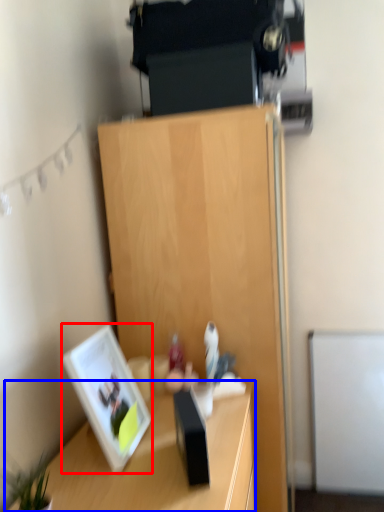
Question: Which point is further to the camera, picture frame (highlighted by a red box) or desk (highlighted by a blue box)?

Choices:
 (A) picture frame
 (B) desk

Answer: (A)